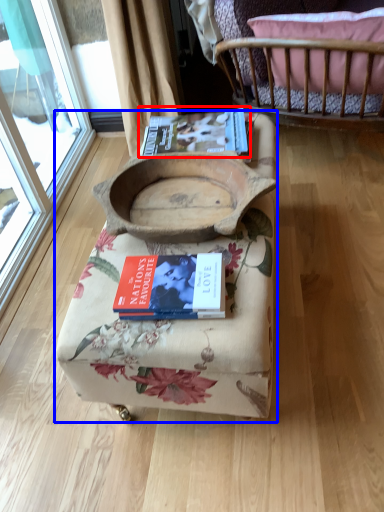
Question: Which point is further to the camera, paperback book (highlighted by a red box) or furniture (highlighted by a blue box)?

Choices:
 (A) paperback book
 (B) furniture

Answer: (A)